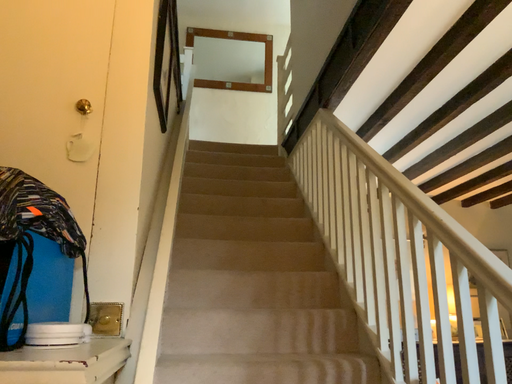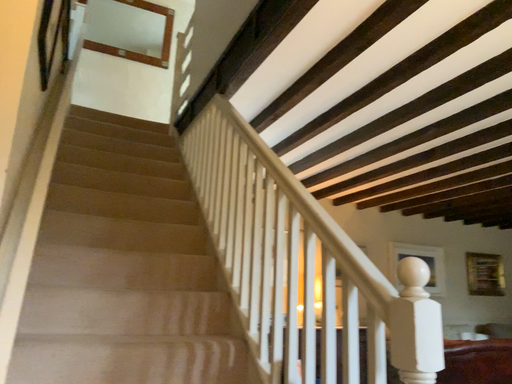
Question: How did the camera likely rotate when shooting the video?

Choices:
 (A) rotated right
 (B) rotated left

Answer: (A)